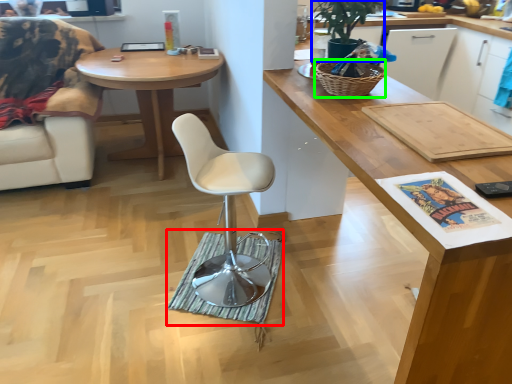
Question: Based on their relative distances, which object is farther from mat (highlighted by a red box)? Choose from houseplant (highlighted by a blue box) and picnic basket (highlighted by a green box).

Choices:
 (A) houseplant
 (B) picnic basket

Answer: (A)